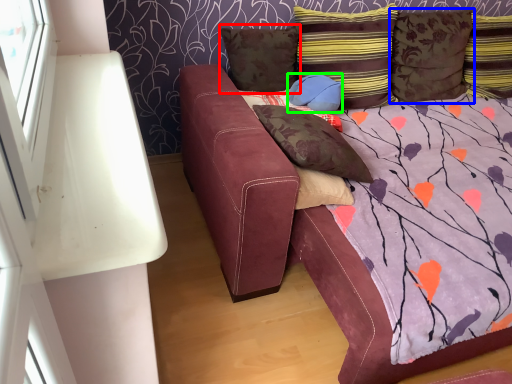
Question: Which object is the farthest from pillow (highlighted by a red box)? Choose among these: pillow (highlighted by a blue box) or pillow (highlighted by a green box).

Choices:
 (A) pillow
 (B) pillow

Answer: (A)